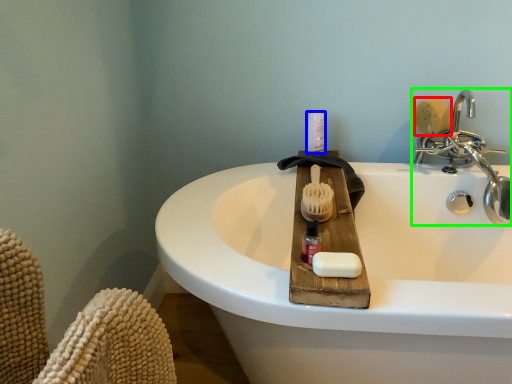
Question: Estimate the real-world distances between objects in this image. Which object is farther from brush (highlighted by a red box), toiletry (highlighted by a blue box) or tap (highlighted by a green box)?

Choices:
 (A) toiletry
 (B) tap

Answer: (A)